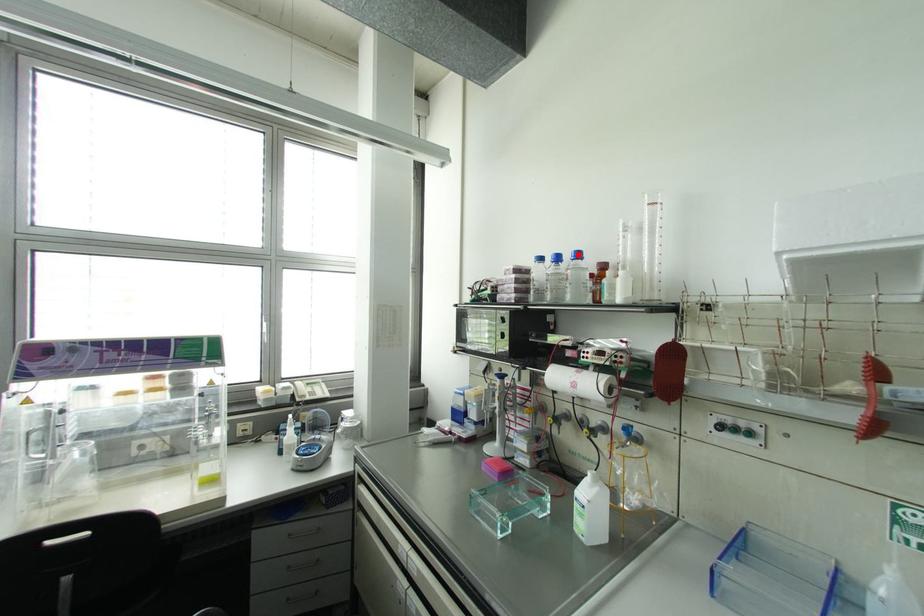
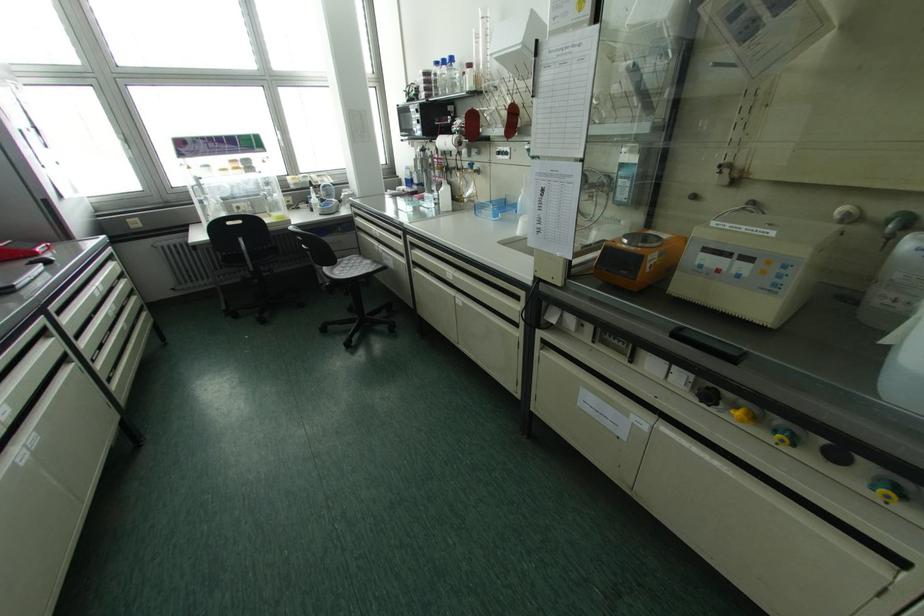
In the second image, find the point that corresponds to the highlighted location in the first image.

(451, 59)